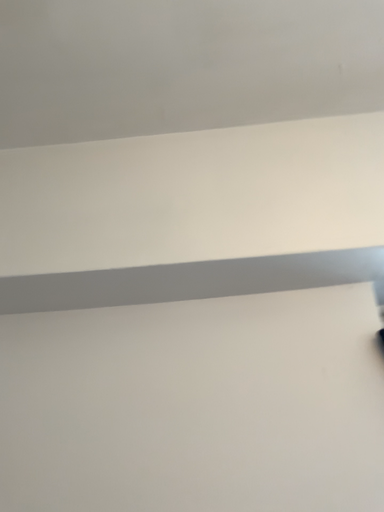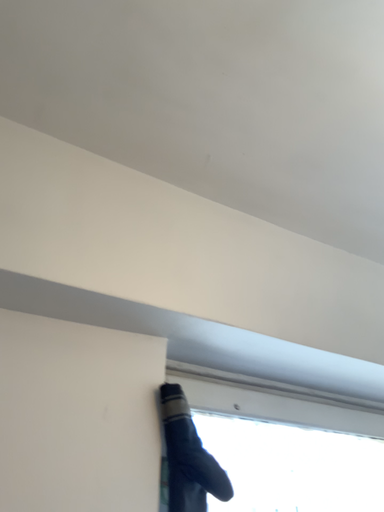
Question: Which way did the camera rotate in the video?

Choices:
 (A) rotated left
 (B) rotated right

Answer: (B)